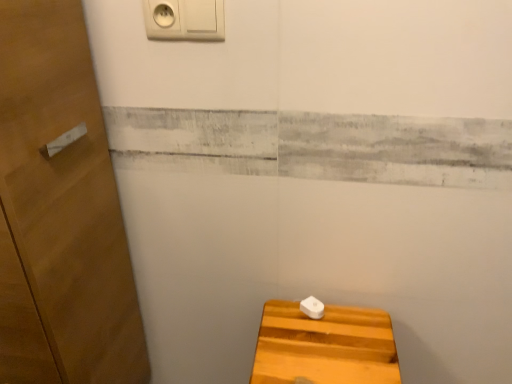
Question: From a real-world perspective, is white plastic knob at lower center beneath light brown wooden stool at lower right?

Choices:
 (A) yes
 (B) no

Answer: (B)

Question: Is white plastic knob at lower center closer to camera compared to light brown wooden stool at lower right?

Choices:
 (A) yes
 (B) no

Answer: (B)

Question: Is white plastic knob at lower center outside light brown wooden stool at lower right?

Choices:
 (A) yes
 (B) no

Answer: (A)

Question: Does white plastic knob at lower center appear on the right side of light brown wooden stool at lower right?

Choices:
 (A) yes
 (B) no

Answer: (B)

Question: Can you confirm if white plastic knob at lower center is bigger than light brown wooden stool at lower right?

Choices:
 (A) yes
 (B) no

Answer: (B)

Question: Is white plastic knob at lower center spatially inside white plastic/light switch at upper center, or outside of it?

Choices:
 (A) outside
 (B) inside

Answer: (A)

Question: From the image's perspective, relative to white plastic/light switch at upper center, is white plastic knob at lower center above or below?

Choices:
 (A) below
 (B) above

Answer: (A)

Question: Would you say white plastic knob at lower center is to the left or to the right of white plastic/light switch at upper center in the picture?

Choices:
 (A) right
 (B) left

Answer: (A)

Question: From a real-world perspective, is white plastic knob at lower center above or below white plastic/light switch at upper center?

Choices:
 (A) below
 (B) above

Answer: (A)

Question: Is point (314, 316) positioned closer to the camera than point (17, 31)?

Choices:
 (A) farther
 (B) closer

Answer: (A)

Question: Is white plastic knob at lower center spatially inside wooden door at left, or outside of it?

Choices:
 (A) outside
 (B) inside

Answer: (A)

Question: Is white plastic knob at lower center in front of or behind wooden door at left in the image?

Choices:
 (A) front
 (B) behind

Answer: (B)

Question: From a real-world perspective, is white plastic knob at lower center physically located above or below wooden door at left?

Choices:
 (A) above
 (B) below

Answer: (B)

Question: Looking at the image, does white plastic/light switch at upper center seem bigger or smaller compared to white plastic knob at lower center?

Choices:
 (A) small
 (B) big

Answer: (B)

Question: Which is correct: white plastic/light switch at upper center is inside white plastic knob at lower center, or outside of it?

Choices:
 (A) outside
 (B) inside

Answer: (A)